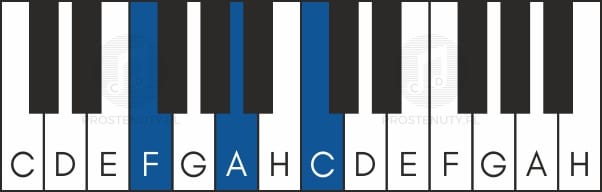
Locate an element on the screen. Image resolution: width=602 pixels, height=192 pixels. keys is located at coordinates (327, 66).